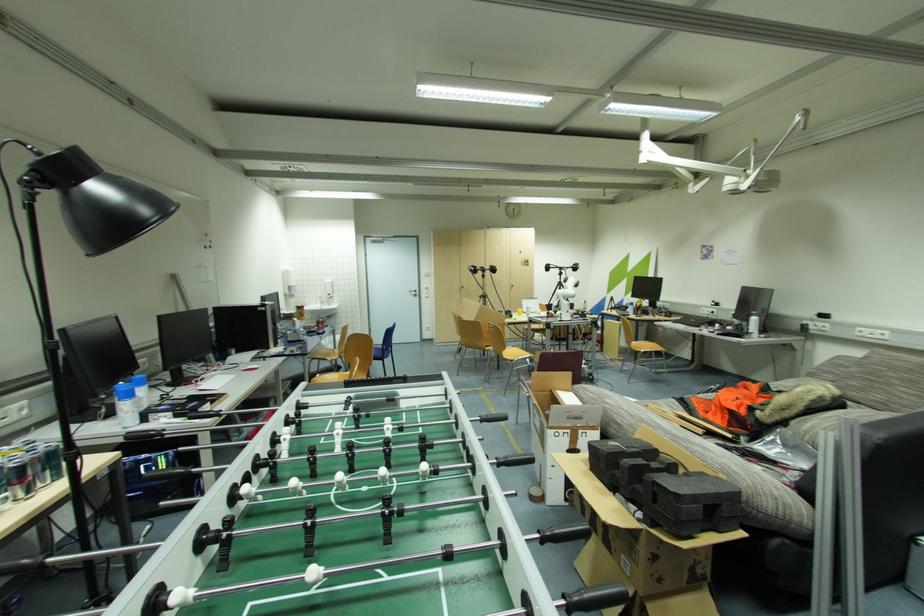
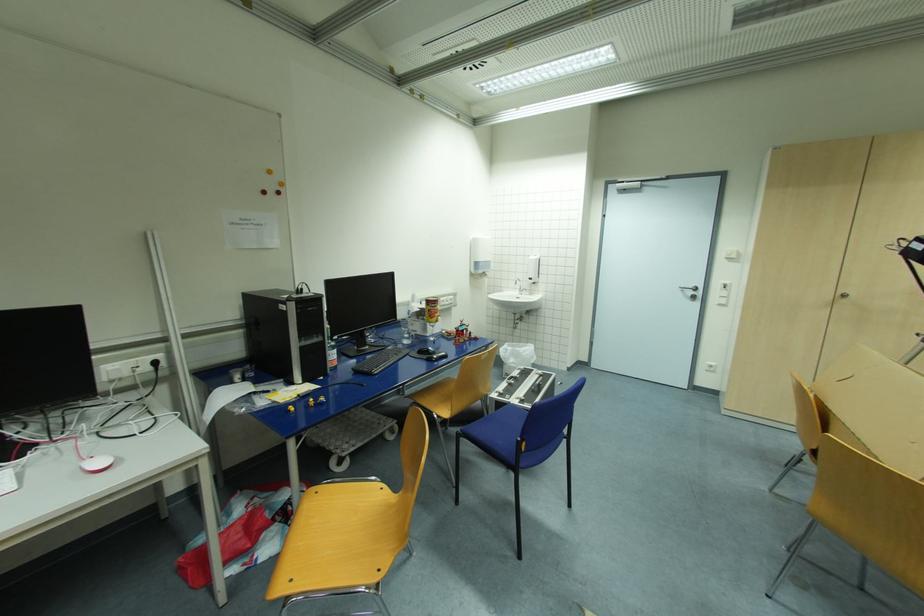
Locate, in the second image, the point that corresponds to the point at 333,294 in the first image.

(533, 280)